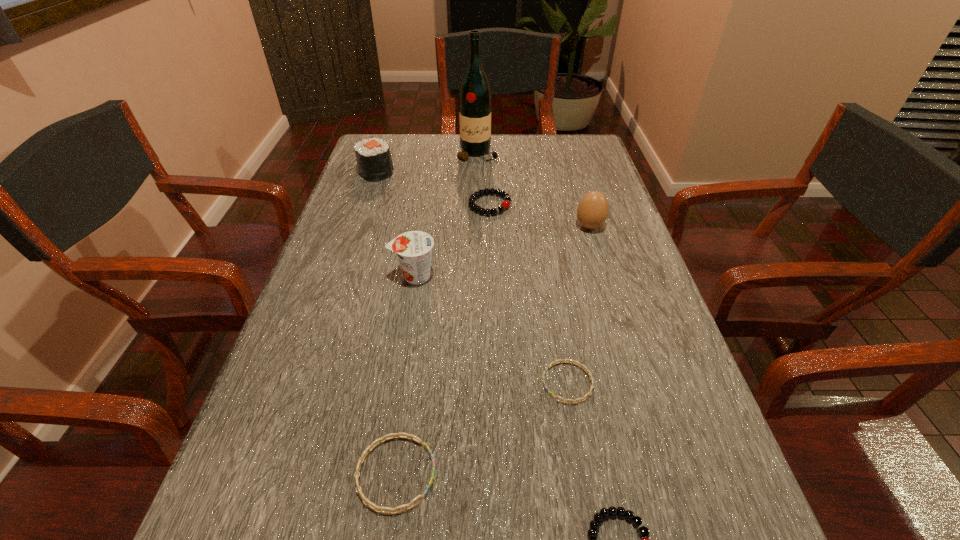
Where is `vacant area at the far left corner of the desktop`? The image size is (960, 540). vacant area at the far left corner of the desktop is located at coordinates (411, 146).

You are a GUI agent. You are given a task and a screenshot of the screen. Output one action in this format:
    pyautogui.click(x=<x>, y=<y>)
    Task: Click on the vacant space at the far right corner of the desktop
    This screenshot has width=960, height=540.
    Given the screenshot: What is the action you would take?
    pyautogui.click(x=595, y=145)

You are a GUI agent. You are given a task and a screenshot of the screen. Output one action in this format:
    pyautogui.click(x=<x>, y=<y>)
    Task: Click on the vacant space in between the shortest object and the left blue bracelet
    
    Given the screenshot: What is the action you would take?
    pyautogui.click(x=482, y=428)

Locate an element on the screen. The image size is (960, 540). unoccupied area between the left blue bracelet and the seventh nearest object is located at coordinates (386, 323).

Find the location of a particular element. Image resolution: width=960 pixels, height=540 pixels. vacant space that's between the rightmost object and the smaller blue bracelet is located at coordinates (579, 305).

The height and width of the screenshot is (540, 960). Find the location of `empty space between the nearer blue bracelet and the tallest object`. empty space between the nearer blue bracelet and the tallest object is located at coordinates click(x=437, y=314).

Where is `vacant region between the brown boiled egg and the yogurt`? vacant region between the brown boiled egg and the yogurt is located at coordinates (502, 251).

In order to click on empty space between the sixth farthest object and the second farthest object in this screenshot , I will do `click(472, 278)`.

Locate an element on the screen. empty space that is in between the left blue bracelet and the green wine bottle is located at coordinates (437, 314).

In order to click on free space between the second farthest bracelet and the nearer blue bracelet in this screenshot , I will do `click(482, 428)`.